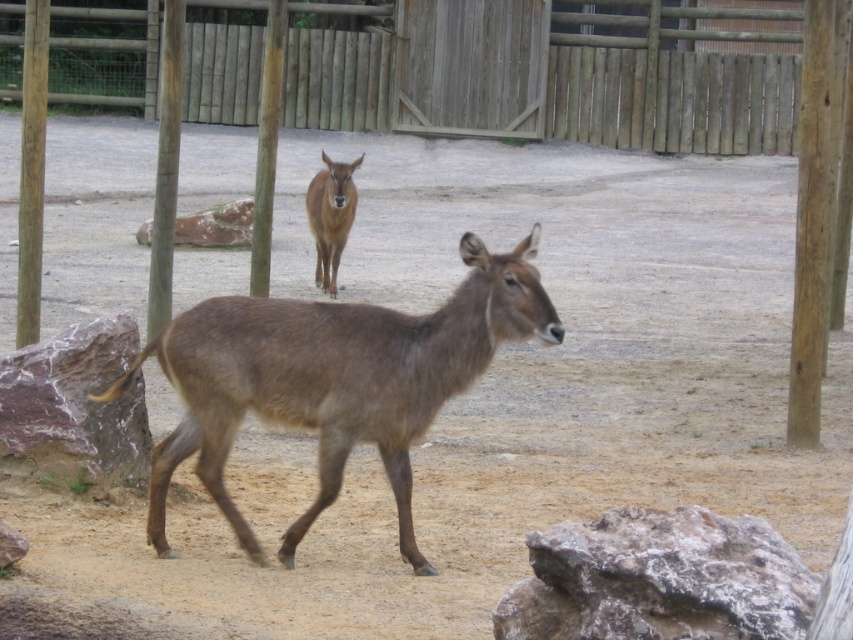
Based on the photo, can you confirm if brown fur deer at center is positioned below brown glossy antelope at center?

Correct, brown fur deer at center is located below brown glossy antelope at center.

Is point (276, 348) in front of point (334, 288)?

Yes, it is in front of point (334, 288).

I want to click on brown fur deer at center, so click(334, 380).

Which is behind, point (618, 104) or point (341, 236)?

Positioned behind is point (618, 104).

Does point (195, 90) lie in front of point (337, 192)?

No, (195, 90) is further to viewer.

Identify the location of wooden gate at upper center. (671, 99).

Which is in front, point (245, 346) or point (671, 77)?

Point (245, 346) is in front.

The image size is (853, 640). What are the coordinates of `brown fur deer at center` in the screenshot? It's located at (334, 380).

Is point (158, 531) positioned before point (688, 83)?

Yes, point (158, 531) is closer to viewer.

I want to click on brown fur deer at center, so click(x=334, y=380).